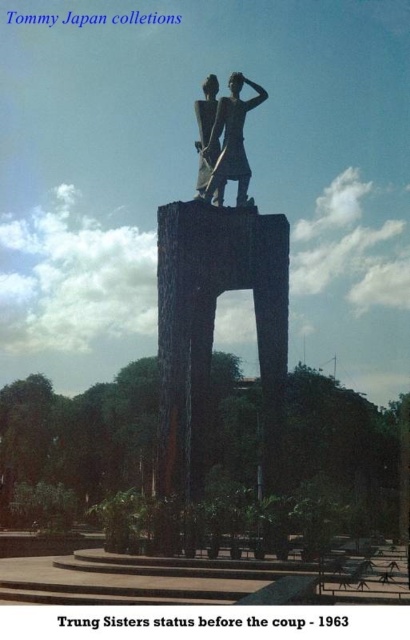
You are standing at the base of the Trung Sisters statue and want to take a photo. There are two points marked on the statue, one at coordinate point[268,428] and another at point[211,172]. Which point is closer to you when you are facing the statue?

Point[268,428] is in front of point[211,172], so the point closer to you when facing the statue is point[268,428].

You are a tour guide leading a group to the statues. You want to ensure that visitors can comfortably walk between the polished bronze statue at center and the dark gray stone statue at center. The path between them is 10.36 meters wide. If each visitor needs 0.5 meters of space to walk comfortably, how many visitors can walk side by side between the two statues?

The path between the polished bronze statue at center and the dark gray stone statue at center is 10.36 meters wide. Dividing this by the required 0.5 meters per visitor gives 10.36 divided by 0.5 equals approximately 20.72. Since you can only have whole visitors, the maximum number is 20 visitors who can walk side by side between the two statues.